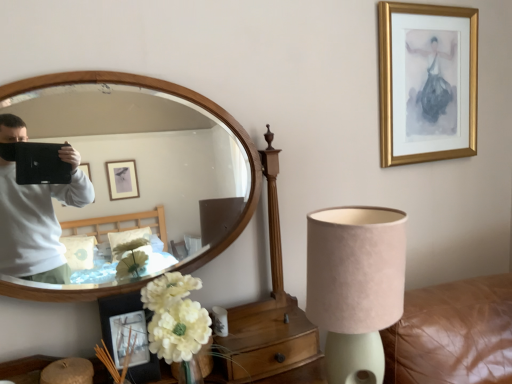
Where is `vacant area on top of wooden drawer at lower center (from a real-world perspective)`? The width and height of the screenshot is (512, 384). vacant area on top of wooden drawer at lower center (from a real-world perspective) is located at coordinates (263, 323).